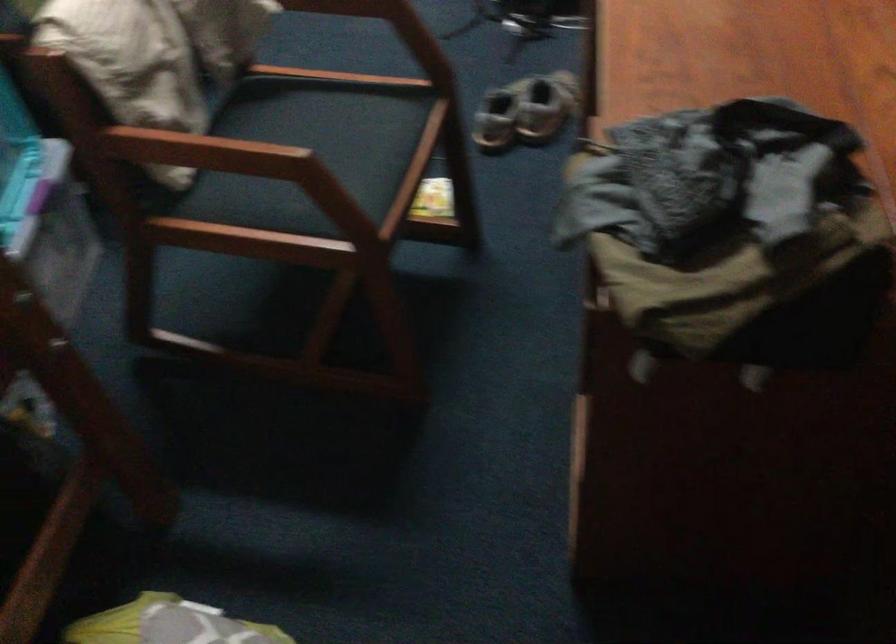
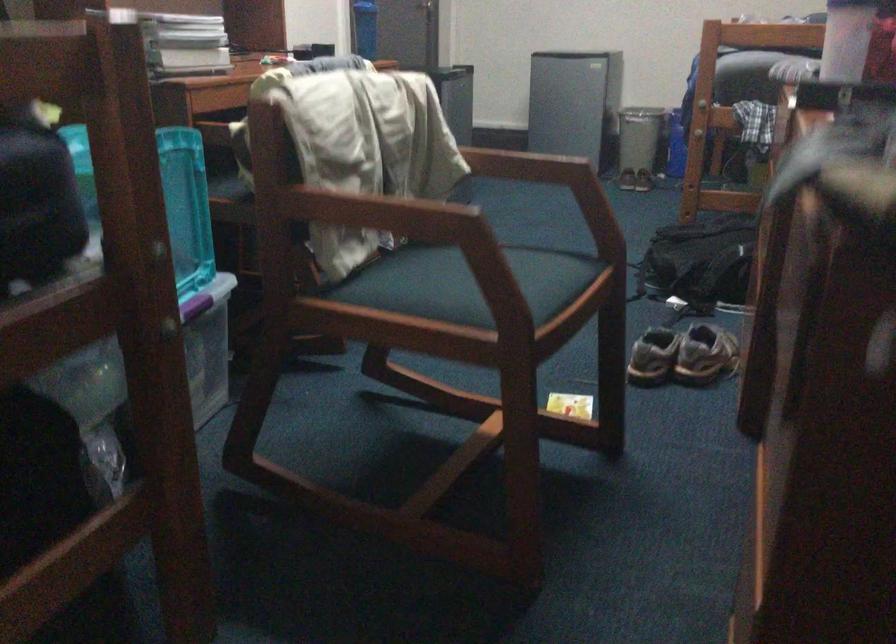
Where in the second image is the point corresponding to (521,118) from the first image?

(682, 355)